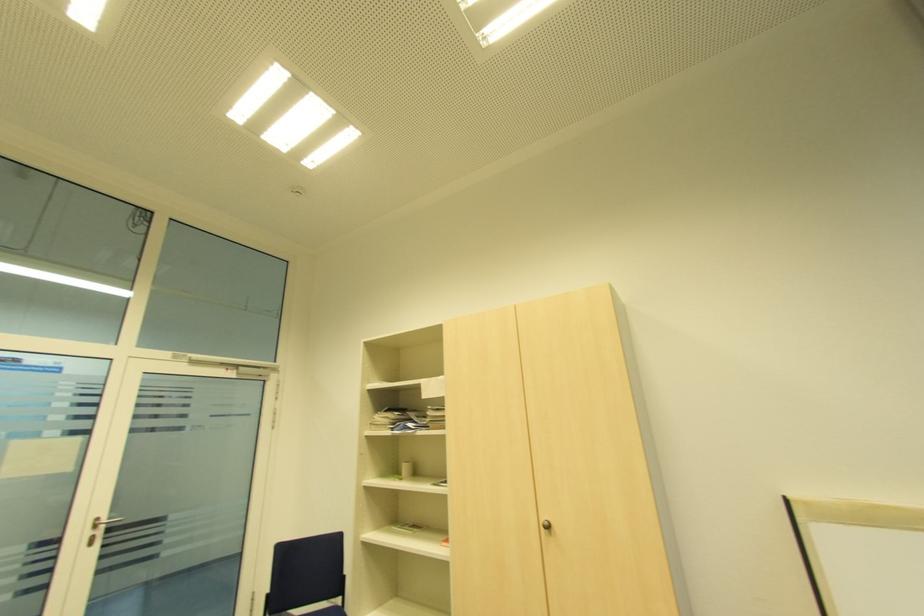
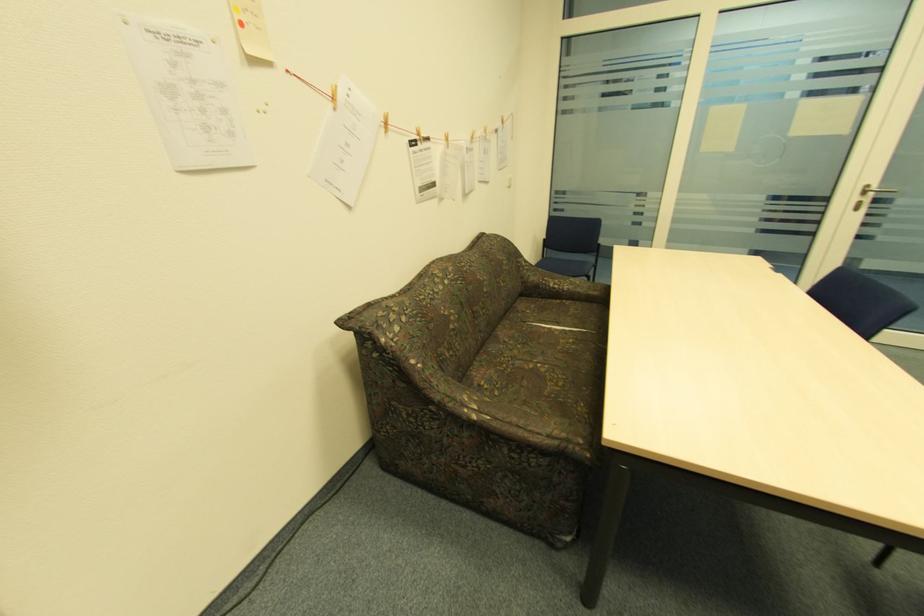
Based on the continuous images, in which direction is the camera rotating?

The camera rotated toward left-down.